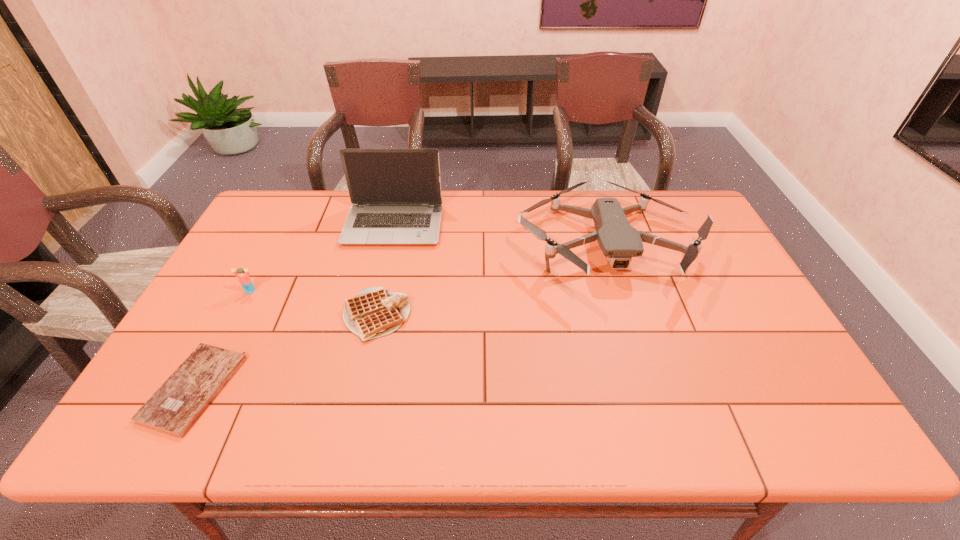
Image resolution: width=960 pixels, height=540 pixels. Find the location of `free spot between the shortest object and the second shortest object`. free spot between the shortest object and the second shortest object is located at coordinates (285, 352).

Where is `vacant area that lies between the drone and the Lego`? Image resolution: width=960 pixels, height=540 pixels. vacant area that lies between the drone and the Lego is located at coordinates (429, 268).

The image size is (960, 540). Identify the location of empty space between the Lego and the rightmost object. (429, 268).

You are a GUI agent. You are given a task and a screenshot of the screen. Output one action in this format:
    pyautogui.click(x=<x>, y=<y>)
    Task: Click on the free space between the third shortest object and the Bible
    The height and width of the screenshot is (540, 960).
    Given the screenshot: What is the action you would take?
    pyautogui.click(x=222, y=340)

Identify which object is located as the nearest to the second shortest object. Please provide its 2D coordinates. Your answer should be formatted as a tuple, i.e. [(x, y)], where the tuple contains the x and y coordinates of a point satisfying the conditions above.

[(396, 198)]

Where is `object that stands as the fourth closest to the fourth tallest object`? object that stands as the fourth closest to the fourth tallest object is located at coordinates (619, 241).

Find the location of a particular element. The height and width of the screenshot is (540, 960). free location that satisfies the following two spatial constraints: 1. on the back side of the Bible; 2. on the left side of the waffle is located at coordinates (233, 315).

Find the location of a particular element. The width and height of the screenshot is (960, 540). free space that satisfies the following two spatial constraints: 1. on the screen of the laptop computer; 2. on the right side of the waffle is located at coordinates (372, 315).

The width and height of the screenshot is (960, 540). What are the coordinates of `free space in the image that satisfies the following two spatial constraints: 1. on the screen of the waffle; 2. on the left side of the laptop computer` in the screenshot? It's located at (372, 315).